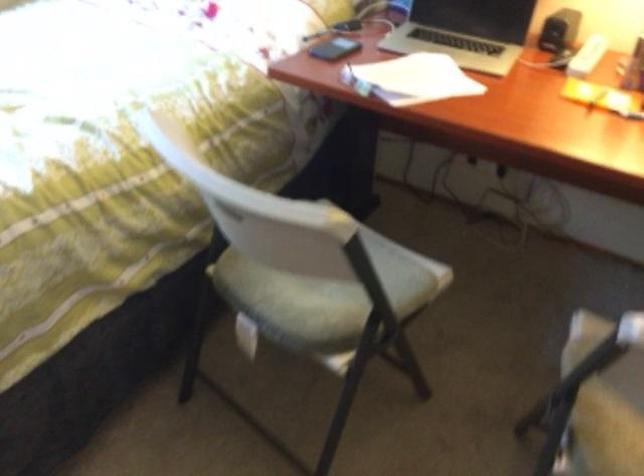
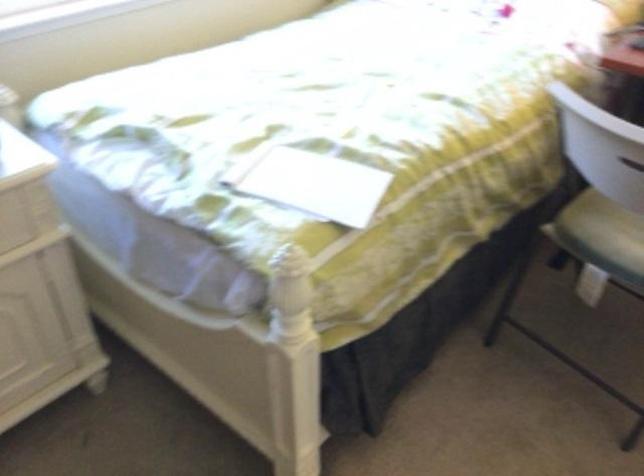
What movement of the cameraman would produce the second image?

The movement direction of the cameraman is left, backward.